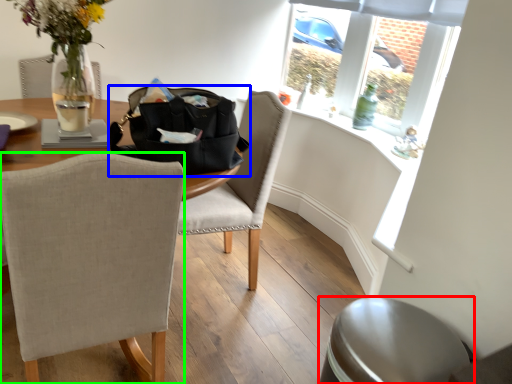
Question: Estimate the real-world distances between objects in this image. Which object is closer to swivel chair (highlighted by a red box), handbag (highlighted by a blue box) or chair (highlighted by a green box)?

Choices:
 (A) handbag
 (B) chair

Answer: (B)